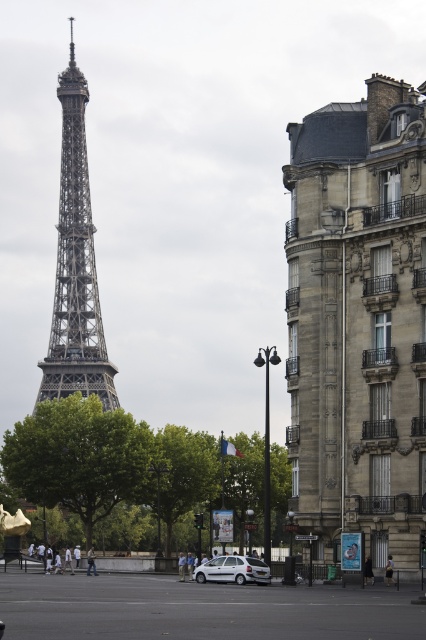
You are standing at the point marked as point (368, 570) in the scene. Which object are you currently on? Please choose from the following options and provide reasoning based on the scene description. The options are the Eiffel Tower, the large ornate building on the right, or the black fabric person at lower center.

The point (368, 570) is located on the black fabric person at lower center according to the description. Therefore, you are currently on the black fabric person at lower center.

You are standing on a street in Paris near the Eiffel Tower. You see two points marked on the ground in front of you. The first point is at coordinates point (91, 564) and the second is at point (183, 573). Which point is closer to you?

Point (91, 564) is closer to you because it is further to the viewer than point (183, 573).